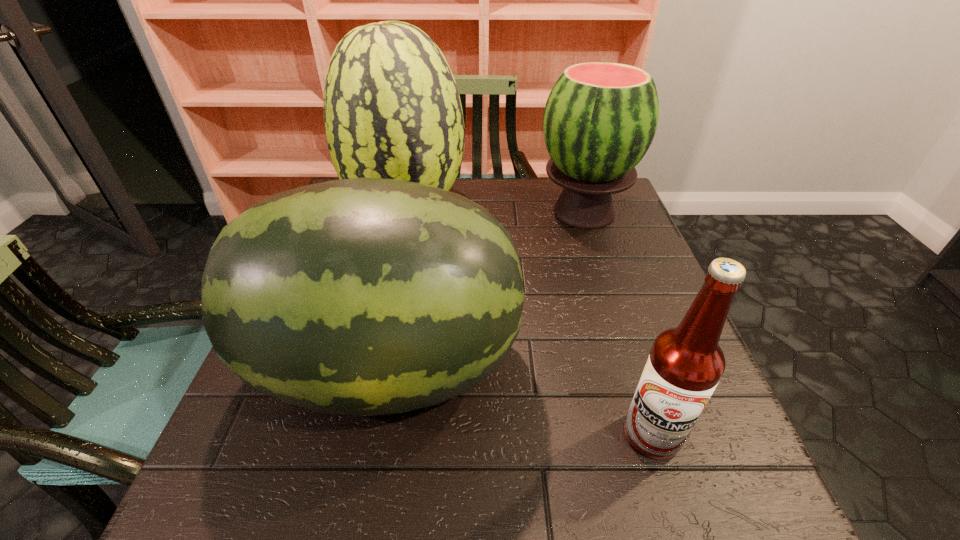
The height and width of the screenshot is (540, 960). Identify the location of vacant space that satisfies the following two spatial constraints: 1. on the front side of the tallest object; 2. on the right side of the rightmost watermelon. [x=405, y=212].